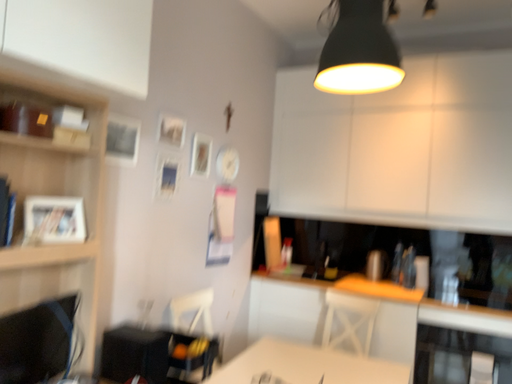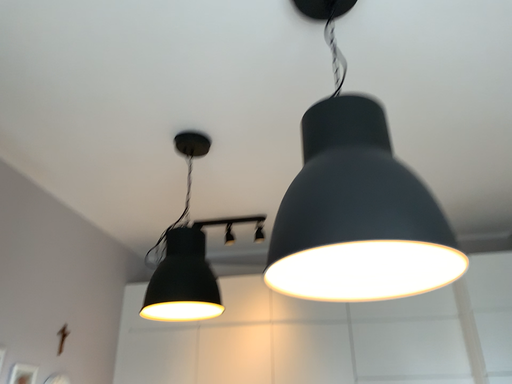
Question: Which way did the camera rotate in the video?

Choices:
 (A) rotated upward
 (B) rotated downward

Answer: (A)